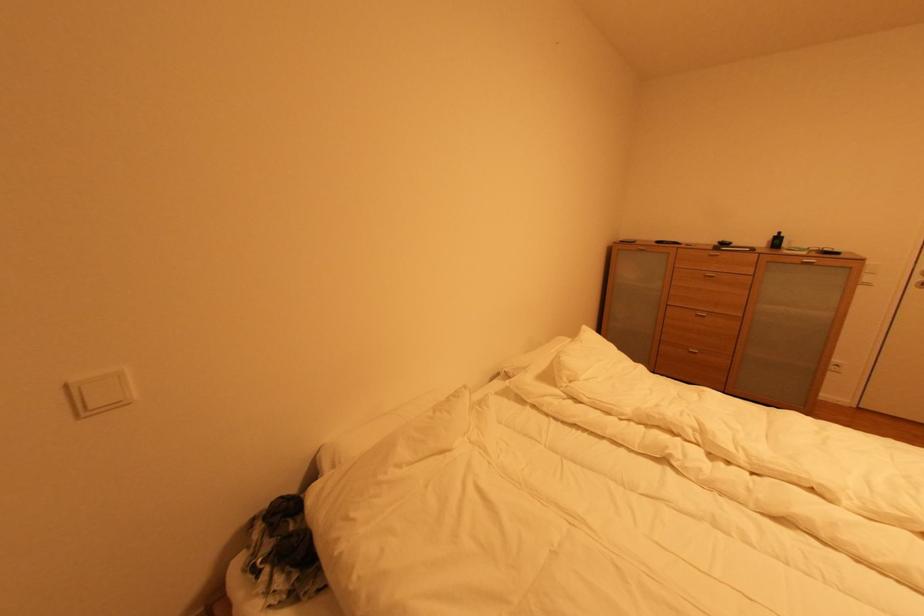
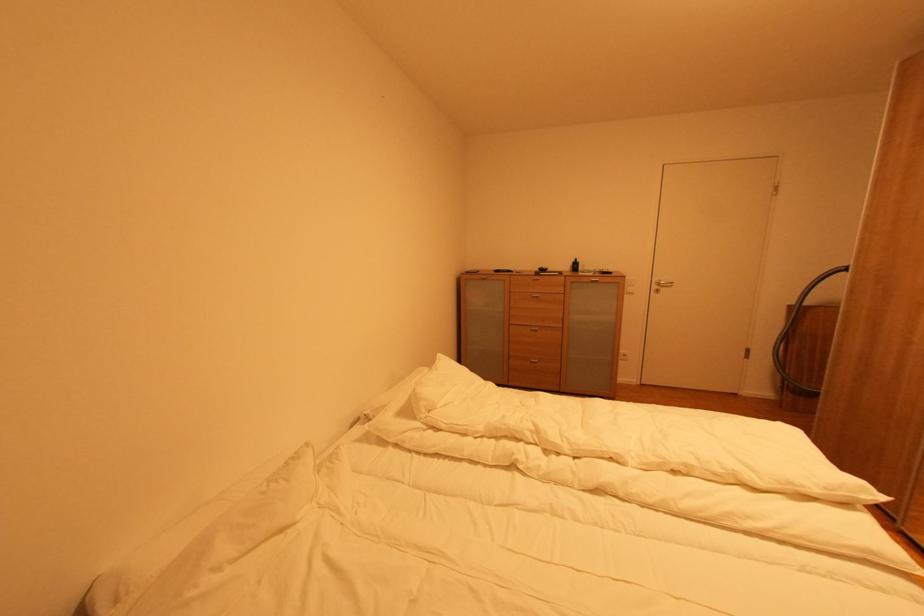
In the second image, find the point that corresponds to the point at 781,238 in the first image.

(578, 264)